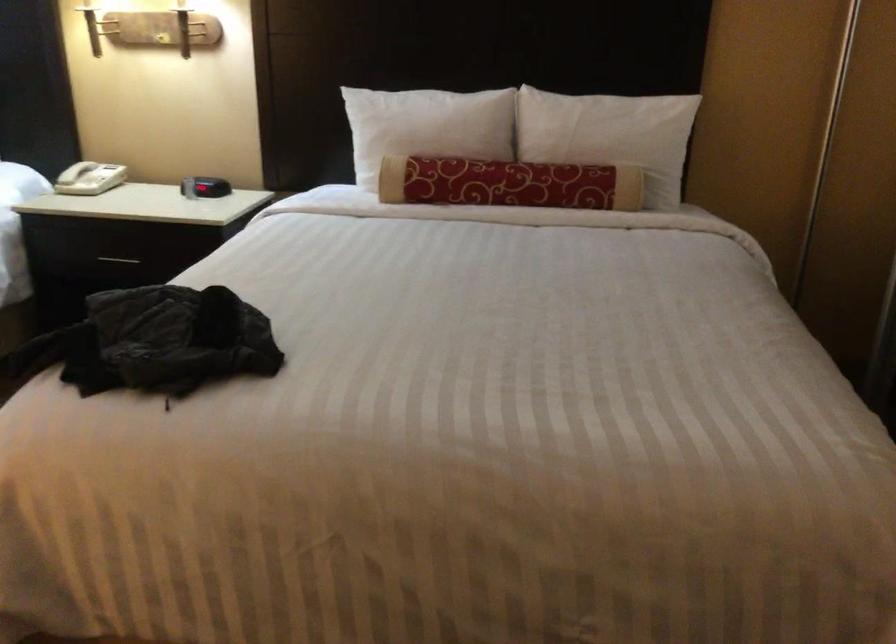
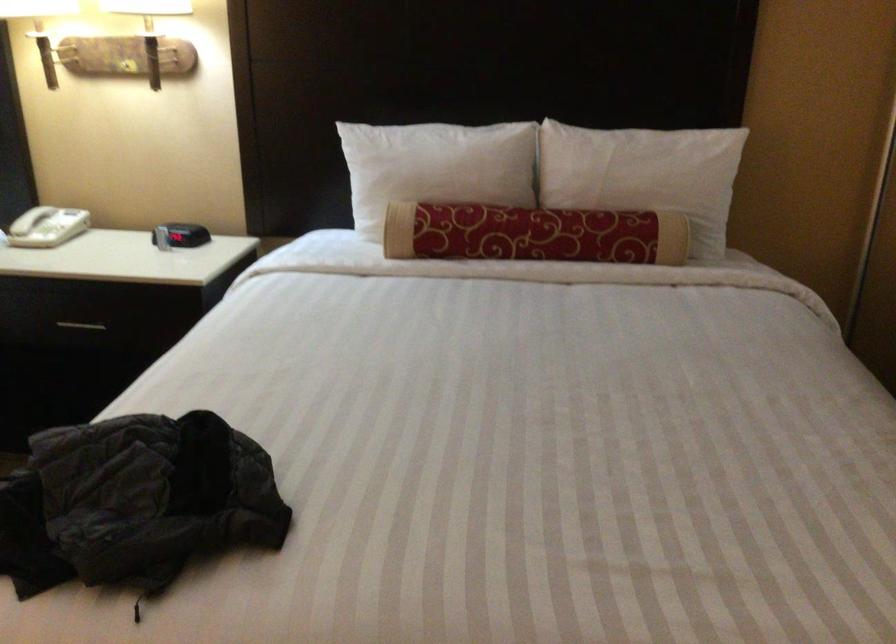
The point at (606, 133) is marked in the first image. Where is the corresponding point in the second image?

(643, 174)